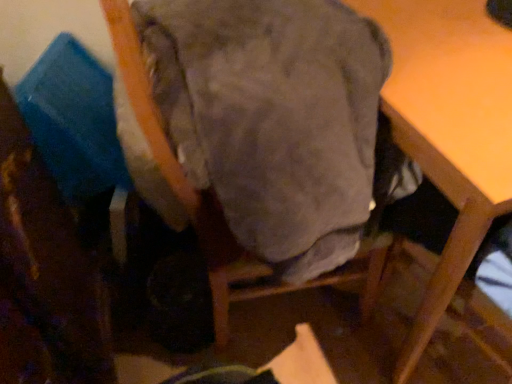
Question: Can you confirm if velvet-like fabric chair at center is smaller than wooden table at upper right?

Choices:
 (A) yes
 (B) no

Answer: (A)

Question: Can you confirm if velvet-like fabric chair at center is shorter than wooden table at upper right?

Choices:
 (A) no
 (B) yes

Answer: (A)

Question: Considering the relative sizes of velvet-like fabric chair at center and wooden table at upper right in the image provided, is velvet-like fabric chair at center taller than wooden table at upper right?

Choices:
 (A) no
 (B) yes

Answer: (B)

Question: Is velvet-like fabric chair at center positioned behind wooden table at upper right?

Choices:
 (A) yes
 (B) no

Answer: (B)

Question: Can you confirm if velvet-like fabric chair at center is positioned to the right of wooden table at upper right?

Choices:
 (A) no
 (B) yes

Answer: (A)

Question: From the image's perspective, does velvet-like fabric chair at center appear higher than wooden table at upper right?

Choices:
 (A) no
 (B) yes

Answer: (A)

Question: Is wooden table at upper right outside of velvet-like fabric chair at center?

Choices:
 (A) no
 (B) yes

Answer: (B)

Question: Does wooden table at upper right have a lesser width compared to velvet-like fabric chair at center?

Choices:
 (A) yes
 (B) no

Answer: (B)

Question: Is velvet-like fabric chair at center located within wooden table at upper right?

Choices:
 (A) yes
 (B) no

Answer: (B)

Question: Does wooden table at upper right have a larger size compared to velvet-like fabric chair at center?

Choices:
 (A) no
 (B) yes

Answer: (B)

Question: From a real-world perspective, does wooden table at upper right stand above velvet-like fabric chair at center?

Choices:
 (A) no
 (B) yes

Answer: (A)

Question: From the image's perspective, is wooden table at upper right above velvet-like fabric chair at center?

Choices:
 (A) no
 (B) yes

Answer: (B)

Question: In the image, is velvet-like fabric chair at center on the left side or the right side of wooden table at upper right?

Choices:
 (A) left
 (B) right

Answer: (A)